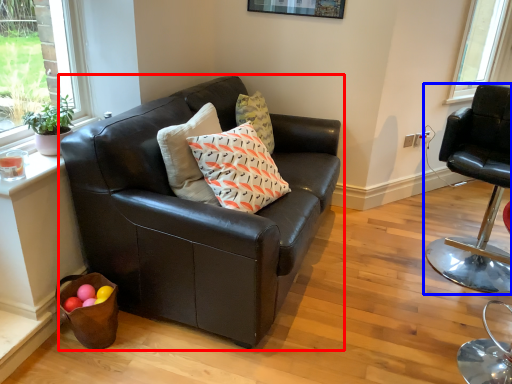
Question: Which object appears farthest to the camera in this image, studio couch (highlighted by a red box) or chair (highlighted by a blue box)?

Choices:
 (A) studio couch
 (B) chair

Answer: (B)